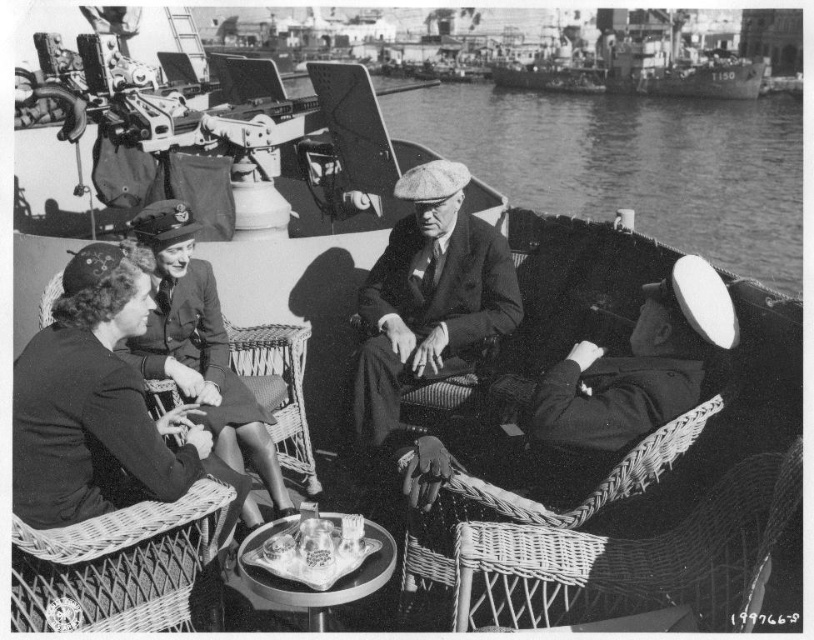
Can you confirm if dark woolen coat at lower left is wider than matte black uniform at center?

In fact, dark woolen coat at lower left might be narrower than matte black uniform at center.

The width and height of the screenshot is (814, 640). What do you see at coordinates (104, 416) in the screenshot?
I see `dark woolen coat at lower left` at bounding box center [104, 416].

Find the location of `dark woolen coat at lower left`. dark woolen coat at lower left is located at coordinates (104, 416).

Image resolution: width=814 pixels, height=640 pixels. I want to click on matte black suit at center, so click(x=427, y=310).

Does matte black suit at center appear over matte black uniform at center?

Yes, matte black suit at center is above matte black uniform at center.

The width and height of the screenshot is (814, 640). In order to click on matte black suit at center in this screenshot , I will do `click(427, 310)`.

At what (x,y) coordinates should I click in order to perform the action: click on matte black suit at center. Please return your answer as a coordinate pair (x, y). The width and height of the screenshot is (814, 640). Looking at the image, I should click on (427, 310).

Based on the photo, which of these two, clear water at center or matte black suit at center, stands taller?

clear water at center is taller.

Is clear water at center to the left of matte black suit at center from the viewer's perspective?

In fact, clear water at center is to the right of matte black suit at center.

Is point (657, 131) closer to camera compared to point (462, 195)?

No, (657, 131) is further to viewer.

Identify the location of clear water at center. (633, 164).